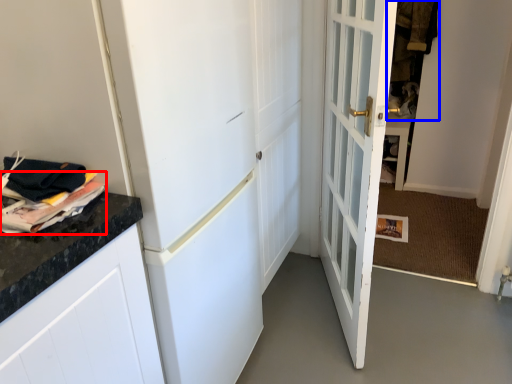
Question: Which object is further to the camera taking this photo, magazine (highlighted by a red box) or laundry (highlighted by a blue box)?

Choices:
 (A) magazine
 (B) laundry

Answer: (B)